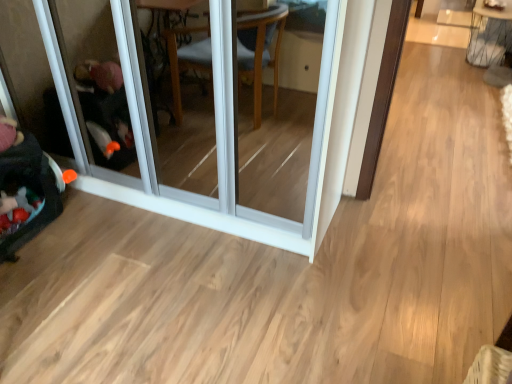
You are a GUI agent. You are given a task and a screenshot of the screen. Output one action in this format:
    pyautogui.click(x=<x>, y=<y>)
    Task: Click on the vacant area that lies between transparent glass screen door at left and velvet black baby carriage at left
    The width and height of the screenshot is (512, 384).
    Given the screenshot: What is the action you would take?
    pyautogui.click(x=137, y=249)